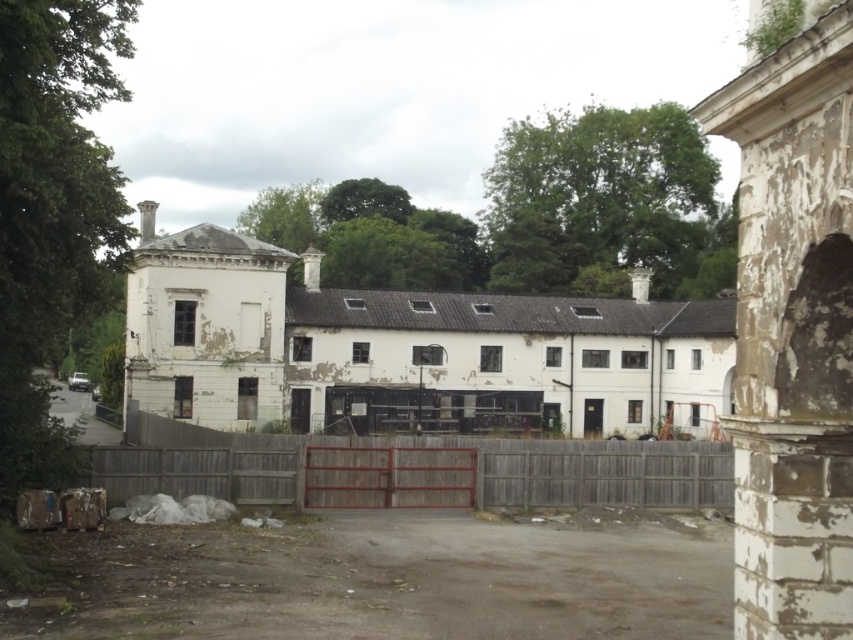
You are a delivery person with a large box that is 2 meters wide. You need to enter the compound through either the wooden gate at center or the white peeling plaster archway at right. Based on their widths, which entrance can accommodate your box?

The wooden gate at center is wider than the white peeling plaster archway at right. Therefore, the wooden gate at center can accommodate the 2 meter wide box, while the white peeling plaster archway at right cannot.